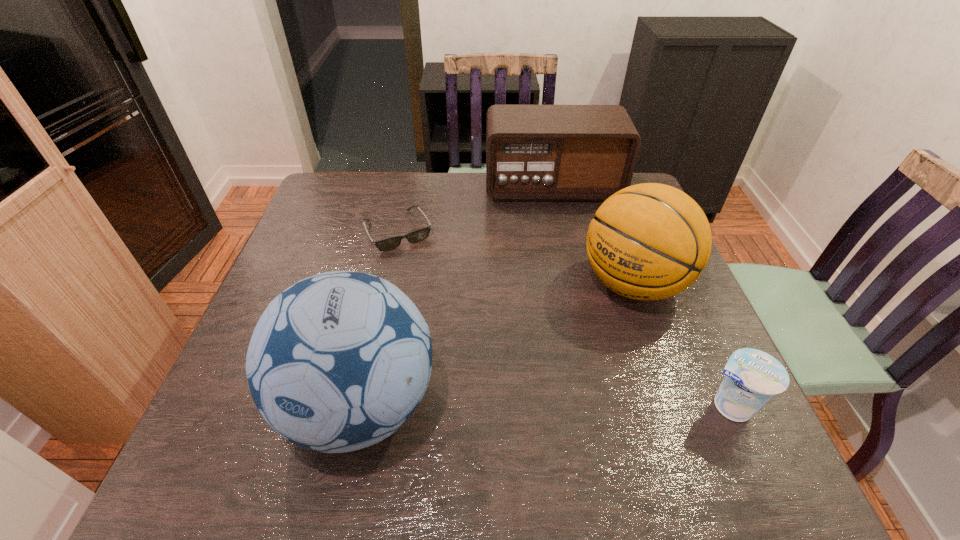
Locate an element on the screen. vacant spot on the desktop that is between the soccer ball and the fourth tallest object and is positioned on the surface of the basketball near the brand logo is located at coordinates (492, 406).

Where is `vacant space on the desktop that is between the soccer ball and the second shortest object and is positioned on the front-facing side of the shortest object`? The width and height of the screenshot is (960, 540). vacant space on the desktop that is between the soccer ball and the second shortest object and is positioned on the front-facing side of the shortest object is located at coordinates (496, 406).

Identify the location of vacant space on the desktop that is between the soccer ball and the yogurt and is positioned on the front-facing side of the third shortest object. (595, 406).